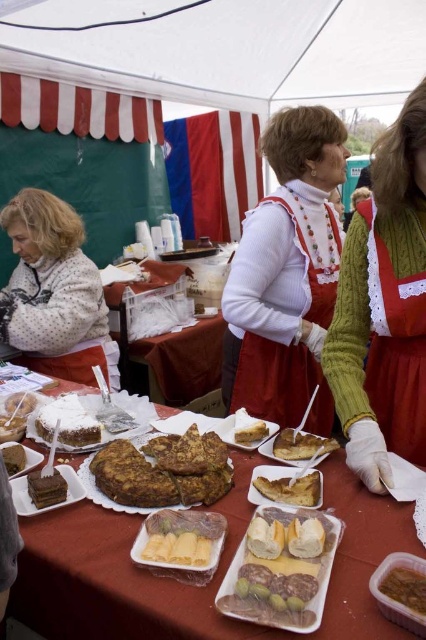
You are a customer at the fair and want to buy both the brown crumbly cake at center and the white frosted cake at center. However, your bag can only carry one cake at a time. If you want to choose the cake that requires fewer trips, which one should you pick?

The brown crumbly cake at center is bigger than the white frosted cake at center, so you should pick the white frosted cake at center to minimize the number of trips since it is smaller and can be carried in one trip.

You are a vendor at the fair and need to place both the green knitted sweater at upper right and the golden brown cake at center on the table. Considering their sizes, which item should you place first to ensure they both fit on the table?

Since the green knitted sweater at upper right is much taller than the golden brown cake at center, you should place the golden brown cake at center first to leave enough space for the taller sweater.